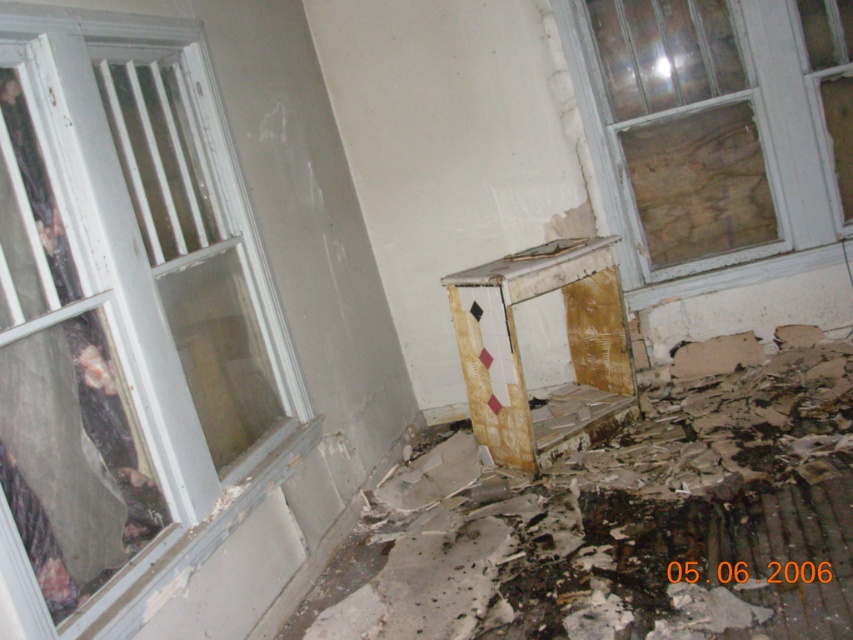
Question: Does white painted wood window at left have a larger size compared to transparent glass window at upper right?

Choices:
 (A) no
 (B) yes

Answer: (B)

Question: Which point is closer to the camera?

Choices:
 (A) (80, 524)
 (B) (657, 298)

Answer: (A)

Question: Considering the relative positions of white painted wood window at left and transparent glass window at upper right in the image provided, where is white painted wood window at left located with respect to transparent glass window at upper right?

Choices:
 (A) right
 (B) left

Answer: (B)

Question: Which object appears closest to the camera in this image?

Choices:
 (A) white painted wood window at left
 (B) transparent glass window at upper right

Answer: (A)

Question: Which point is farther from the camera taking this photo?

Choices:
 (A) (808, 93)
 (B) (16, 116)

Answer: (A)

Question: From the image, what is the correct spatial relationship of white painted wood window at left in relation to transparent glass window at upper right?

Choices:
 (A) left
 (B) right

Answer: (A)